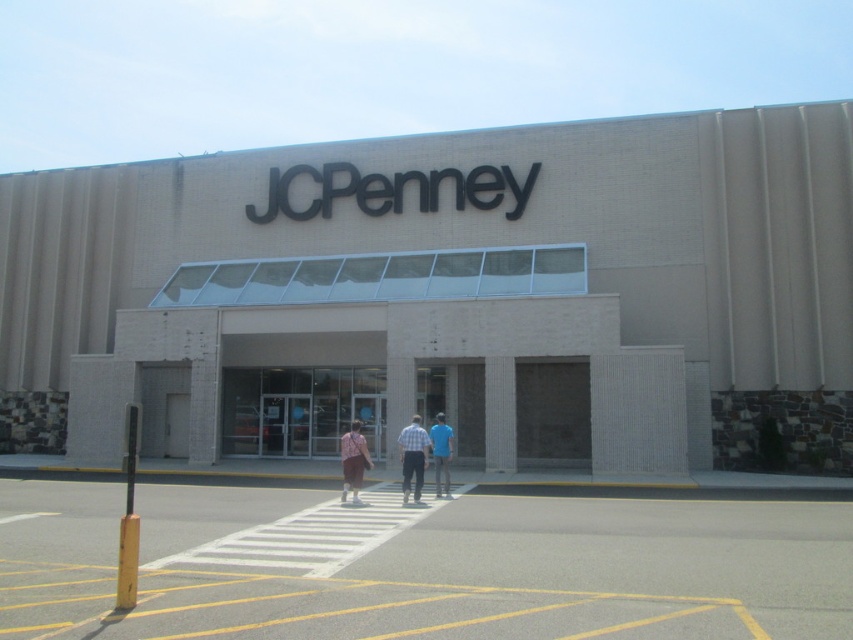
You are standing in front of the JCPenney store and see two points marked on the ground. The first point is at coordinates point [405,488] and the second is at point [401,429]. Which point is closer to your current position?

Point [405,488] is closer to the camera than point [401,429], so the first point is closer to your current position.

You are standing at the crosswalk in front of the JCPenney store and notice the beige brick mall at center and the matte pink shirt at center. Which object would appear bigger to someone looking at the scene from your position?

The beige brick mall at center appears larger than the matte pink shirt at center because it has a larger size compared to it.